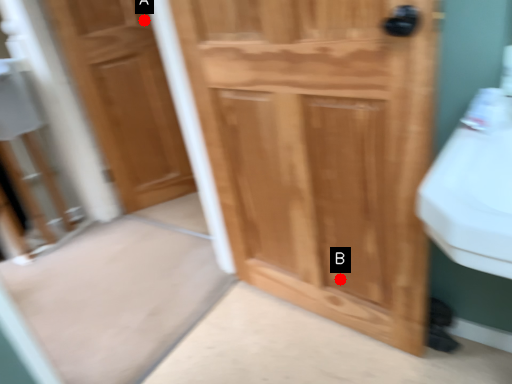
Question: Two points are circled on the image, labeled by A and B beside each circle. Which of the following is the farthest from the observer?

Choices:
 (A) A is further
 (B) B is further

Answer: (A)